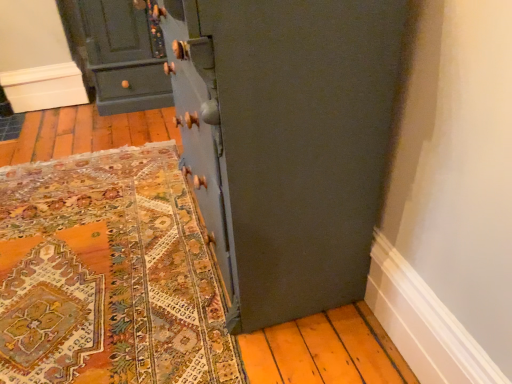
Question: Is point (81, 49) positioned closer to the camera than point (309, 102)?

Choices:
 (A) farther
 (B) closer

Answer: (A)

Question: In the image, is matte dark green cabinet at upper left positioned in front of or behind matte blue cupboard at center?

Choices:
 (A) behind
 (B) front

Answer: (A)

Question: Is matte dark green cabinet at upper left bigger or smaller than matte blue cupboard at center?

Choices:
 (A) small
 (B) big

Answer: (A)

Question: From a real-world perspective, is matte blue cupboard at center positioned above or below matte dark green cabinet at upper left?

Choices:
 (A) above
 (B) below

Answer: (A)

Question: Considering their positions, is matte blue cupboard at center located in front of or behind matte dark green cabinet at upper left?

Choices:
 (A) behind
 (B) front

Answer: (B)

Question: From their relative heights in the image, would you say matte blue cupboard at center is taller or shorter than matte dark green cabinet at upper left?

Choices:
 (A) short
 (B) tall

Answer: (B)

Question: Based on their sizes in the image, would you say matte blue cupboard at center is bigger or smaller than matte dark green cabinet at upper left?

Choices:
 (A) big
 (B) small

Answer: (A)